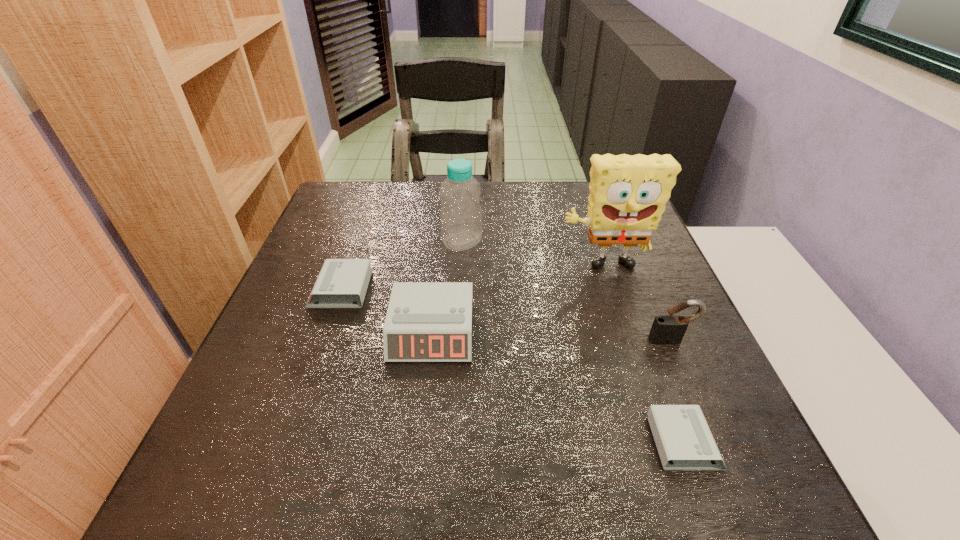
The width and height of the screenshot is (960, 540). I want to click on free space between the farthest object and the shortest alarm clock, so click(x=573, y=342).

In order to click on free space between the leftmost object and the tallest object in this screenshot , I will do `click(471, 279)`.

In order to click on vacant point located between the second tallest alarm clock and the fourth shortest object in this screenshot , I will do `click(506, 315)`.

Where is `unoccupied area between the shortest alarm clock and the leftmost alarm clock`? The height and width of the screenshot is (540, 960). unoccupied area between the shortest alarm clock and the leftmost alarm clock is located at coordinates (513, 366).

The height and width of the screenshot is (540, 960). I want to click on vacant point located between the leftmost alarm clock and the bottle, so click(x=401, y=266).

The image size is (960, 540). What are the coordinates of `empty space that is in between the shortest alarm clock and the second shortest object` in the screenshot? It's located at point(513,366).

This screenshot has width=960, height=540. Find the location of `vacant region between the tallest object and the shortest object`. vacant region between the tallest object and the shortest object is located at coordinates (643, 355).

In order to click on blank region between the second shortest object and the third tallest object in this screenshot , I will do `click(506, 315)`.

At what (x,y) coordinates should I click in order to perform the action: click on vacant point located between the padlock and the bottle. Please return your answer as a coordinate pair (x, y). This screenshot has height=540, width=960. Looking at the image, I should click on (x=566, y=291).

Locate which object is the closest to the tallest object. Please provide its 2D coordinates. Your answer should be formatted as a tuple, i.e. [(x, y)], where the tuple contains the x and y coordinates of a point satisfying the conditions above.

[(669, 329)]